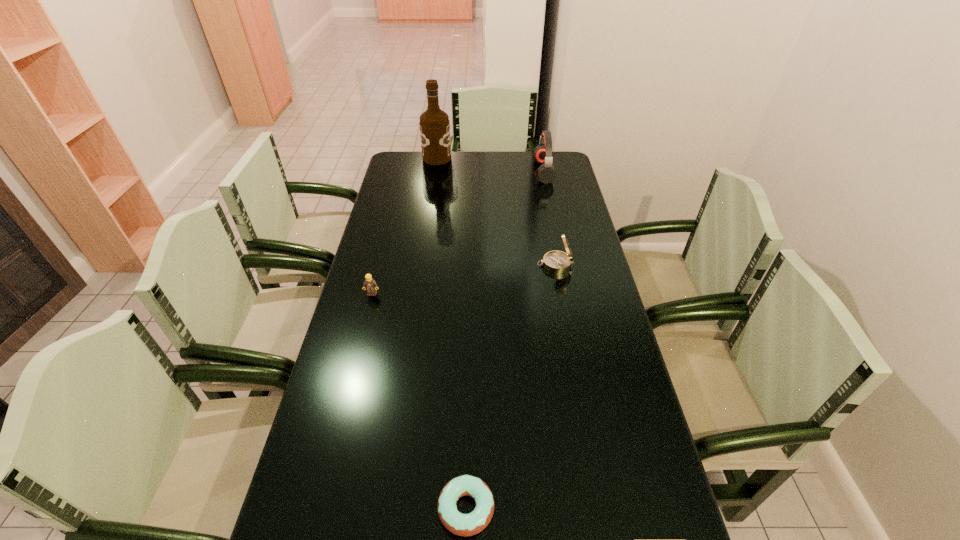
Locate an element on the screen. alcohol is located at coordinates (434, 123).

Where is `the second object from left to right`? This screenshot has width=960, height=540. the second object from left to right is located at coordinates (434, 123).

Where is `the second tallest object`? the second tallest object is located at coordinates (543, 152).

Locate an element on the screen. The height and width of the screenshot is (540, 960). the third tallest object is located at coordinates (x=558, y=262).

The height and width of the screenshot is (540, 960). I want to click on compass, so click(x=558, y=262).

What are the coordinates of `the second nearest object` in the screenshot? It's located at (369, 284).

Identify the location of Lego. (369, 284).

I want to click on the third object from left to right, so click(460, 524).

Identify the location of doughnut. The image size is (960, 540). (460, 524).

At what (x,y) coordinates should I click in order to perform the action: click on free space located on the label of the alcohol. Please return your answer as a coordinate pair (x, y). The image size is (960, 540). Looking at the image, I should click on (501, 158).